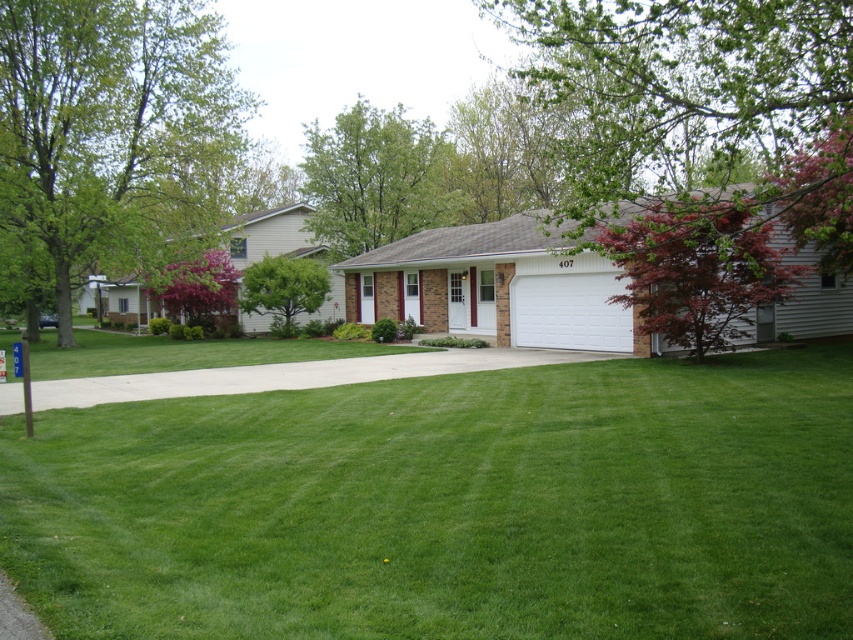
You are a landscape architect designing a garden path between the green leafy tree at upper left and the pink flowering bush at center. Which object should you consider as the larger one to ensure the path is wide enough?

The green leafy tree at upper left is larger in size than the pink flowering bush at center, so you should consider the green leafy tree at upper left when designing the path to ensure sufficient width.

You are standing in the front yard of the house and want to walk from the green leafy tree at upper center to the green grass at center. Which direction should you move?

Since the green grass at center is to the right of the green leafy tree at upper center, you should move to the right to reach the green grass at center from the green leafy tree at upper center.

You are a landscape architect designing a garden layout. You need to place a new bench that requires at least 3 meters of space between the green leafy tree at upper left and the pink flowering bush at center. Is there enough space based on their widths?

The green leafy tree at upper left is wider than the pink flowering bush at center. However, the question is about the space between them, not their widths. Since the scene description doesn not provide information about the distance between them, I cannot determine if there is enough space for the bench.